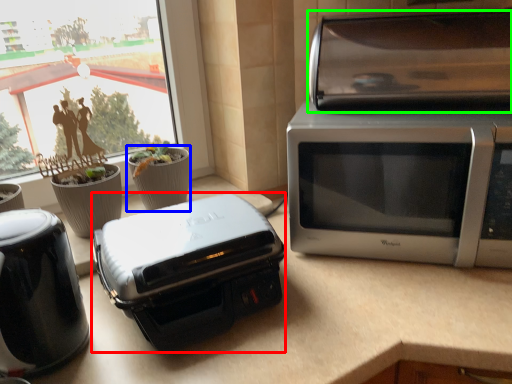
Question: Which object is positioned closest to toaster (highlighted by a red box)? Select from flowerpot (highlighted by a blue box) and stereo (highlighted by a green box).

Choices:
 (A) flowerpot
 (B) stereo

Answer: (A)